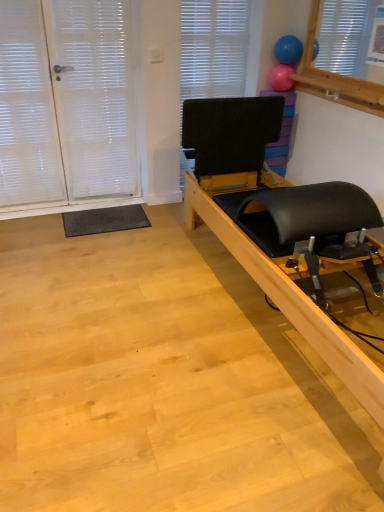
The width and height of the screenshot is (384, 512). What are the coordinates of `vacant space in pink rubber balloon at upper center, positioned as the second balloon in top-to-bottom order (from a real-world perspective)` in the screenshot? It's located at (288, 93).